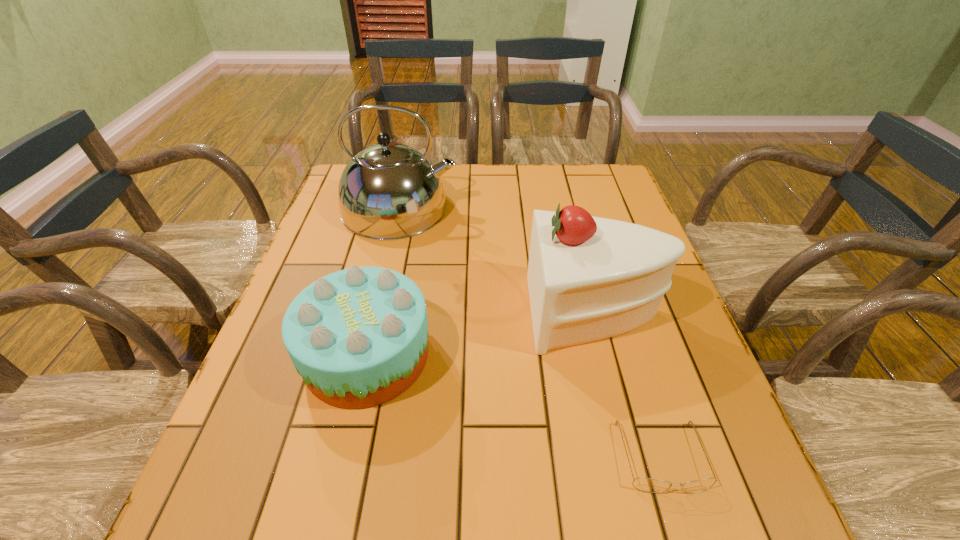
The image size is (960, 540). In the image, there is a desktop. Find the location of `vacant area at the right edge`. vacant area at the right edge is located at coordinates (649, 323).

The height and width of the screenshot is (540, 960). In the image, there is a desktop. In order to click on vacant space at the near left corner in this screenshot , I will do `click(240, 495)`.

Identify the location of vacant space at the far right corner of the desktop. This screenshot has width=960, height=540. (624, 193).

Where is `free point between the farthest object and the nearest object`? This screenshot has height=540, width=960. free point between the farthest object and the nearest object is located at coordinates (531, 333).

Where is `empty location between the kettle and the right cake`? The height and width of the screenshot is (540, 960). empty location between the kettle and the right cake is located at coordinates (497, 260).

Image resolution: width=960 pixels, height=540 pixels. I want to click on free point between the shortest object and the kettle, so click(531, 333).

What are the coordinates of `free space between the right cake and the third tallest object` in the screenshot? It's located at (481, 334).

Find the location of a particular element. Image resolution: width=960 pixels, height=540 pixels. free spot between the shortest object and the shorter cake is located at coordinates (515, 406).

Find the location of a particular element. The height and width of the screenshot is (540, 960). blank region between the second shortest object and the right cake is located at coordinates (481, 334).

Identify the location of vacant area between the nearest object and the farthest object. This screenshot has width=960, height=540. (531, 333).